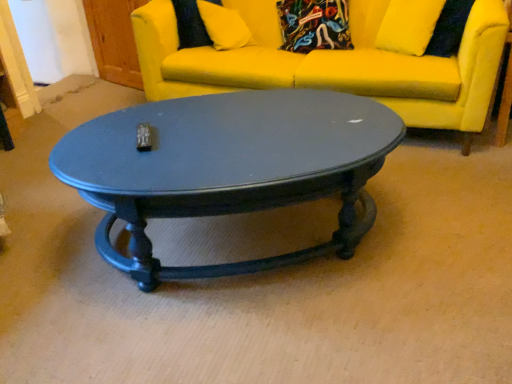
I want to click on empty space that is ontop of matte black coffee table at center (from a real-world perspective), so click(x=238, y=126).